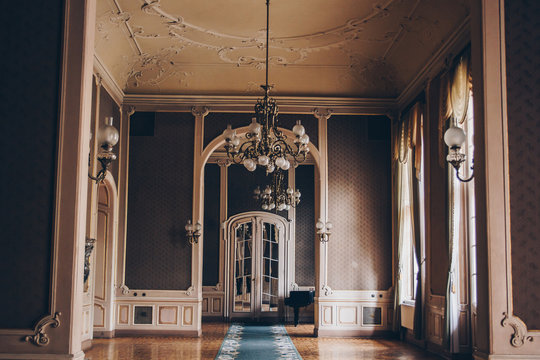
The height and width of the screenshot is (360, 540). In order to click on white swirls on wlls in this screenshot , I will do `click(513, 316)`, `click(51, 314)`.